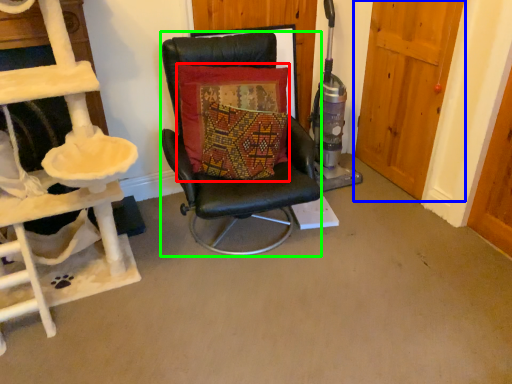
Question: Which object is the closest to the pillow (highlighted by a red box)? Choose among these: door (highlighted by a blue box) or chair (highlighted by a green box).

Choices:
 (A) door
 (B) chair

Answer: (B)